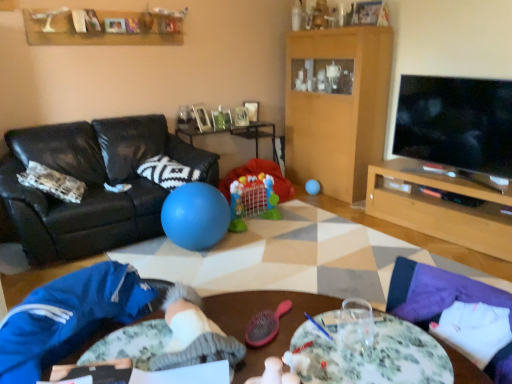
Question: From a real-world perspective, is wooden tv stand at right, which is the second table in back-to-front order, over floral-patterned glass at center?

Choices:
 (A) yes
 (B) no

Answer: (B)

Question: Is wooden tv stand at right, the first table positioned from the right, smaller than floral-patterned glass at center?

Choices:
 (A) yes
 (B) no

Answer: (B)

Question: Does wooden tv stand at right, the first table positioned from the right, come in front of floral-patterned glass at center?

Choices:
 (A) yes
 (B) no

Answer: (B)

Question: Is wooden tv stand at right, which is the second table in back-to-front order, facing towards floral-patterned glass at center?

Choices:
 (A) yes
 (B) no

Answer: (A)

Question: Is wooden tv stand at right, placed as the 1th table when sorted from front to back, not within floral-patterned glass at center?

Choices:
 (A) yes
 (B) no

Answer: (A)

Question: Is white knitted pillow at center surrounding blue rubber ball at center, positioned as the second ball in right-to-left order?

Choices:
 (A) yes
 (B) no

Answer: (B)

Question: Is white knitted pillow at center facing towards blue rubber ball at center, which is the first ball from front to back?

Choices:
 (A) yes
 (B) no

Answer: (A)

Question: Does white knitted pillow at center have a smaller size compared to blue rubber ball at center, which appears as the 2th ball when viewed from the back?

Choices:
 (A) yes
 (B) no

Answer: (A)

Question: Can you confirm if white knitted pillow at center is wider than blue rubber ball at center, the 1th ball from the left?

Choices:
 (A) yes
 (B) no

Answer: (A)

Question: Can you confirm if white knitted pillow at center is shorter than blue rubber ball at center, positioned as the second ball in right-to-left order?

Choices:
 (A) yes
 (B) no

Answer: (A)

Question: Is white knitted pillow at center bigger than blue rubber ball at center, the 1th ball from the left?

Choices:
 (A) yes
 (B) no

Answer: (B)

Question: Is wooden picture frame at upper center, the second picture frame in the left-to-right sequence, positioned before blue fleece pants at lower left?

Choices:
 (A) no
 (B) yes

Answer: (A)